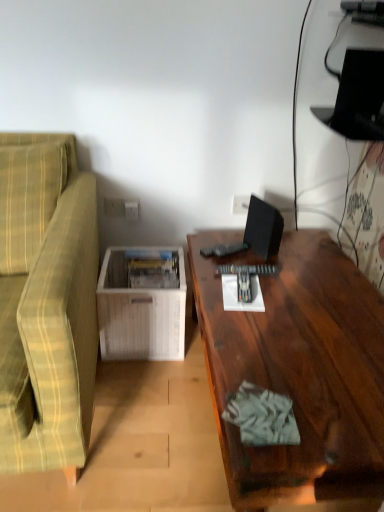
Question: From a real-world perspective, is white plastic electric outlet at center, which is the 2th electric outlet from front to back, physically below green plaid fabric couch at left?

Choices:
 (A) yes
 (B) no

Answer: (B)

Question: From a real-world perspective, is white plastic electric outlet at center, placed as the first electric outlet when sorted from back to front, physically above green plaid fabric couch at left?

Choices:
 (A) yes
 (B) no

Answer: (A)

Question: Considering the relative sizes of white plastic electric outlet at center, placed as the first electric outlet when sorted from back to front, and green plaid fabric couch at left in the image provided, is white plastic electric outlet at center, placed as the first electric outlet when sorted from back to front, thinner than green plaid fabric couch at left?

Choices:
 (A) no
 (B) yes

Answer: (B)

Question: Does white plastic electric outlet at center, placed as the first electric outlet when sorted from back to front, appear on the right side of green plaid fabric couch at left?

Choices:
 (A) yes
 (B) no

Answer: (A)

Question: Is the position of white plastic electric outlet at center, placed as the first electric outlet when sorted from right to left, more distant than that of green plaid fabric couch at left?

Choices:
 (A) no
 (B) yes

Answer: (B)

Question: Does white plastic electric outlet at center, the second electric outlet positioned from the left, have a lesser height compared to green plaid fabric couch at left?

Choices:
 (A) yes
 (B) no

Answer: (A)

Question: From a real-world perspective, is black matte computer monitor at upper right on green plaid fabric couch at left?

Choices:
 (A) no
 (B) yes

Answer: (B)

Question: Is black matte computer monitor at upper right oriented towards green plaid fabric couch at left?

Choices:
 (A) yes
 (B) no

Answer: (A)

Question: Can you confirm if black matte computer monitor at upper right is wider than green plaid fabric couch at left?

Choices:
 (A) yes
 (B) no

Answer: (B)

Question: Does black matte computer monitor at upper right have a greater height compared to green plaid fabric couch at left?

Choices:
 (A) no
 (B) yes

Answer: (A)

Question: Is black matte computer monitor at upper right oriented away from green plaid fabric couch at left?

Choices:
 (A) no
 (B) yes

Answer: (A)

Question: Is black matte computer monitor at upper right completely or partially outside of green plaid fabric couch at left?

Choices:
 (A) yes
 (B) no

Answer: (A)

Question: Considering the relative positions of green plaid fabric couch at left and white wood magazine rack at lower left in the image provided, is green plaid fabric couch at left behind white wood magazine rack at lower left?

Choices:
 (A) yes
 (B) no

Answer: (B)